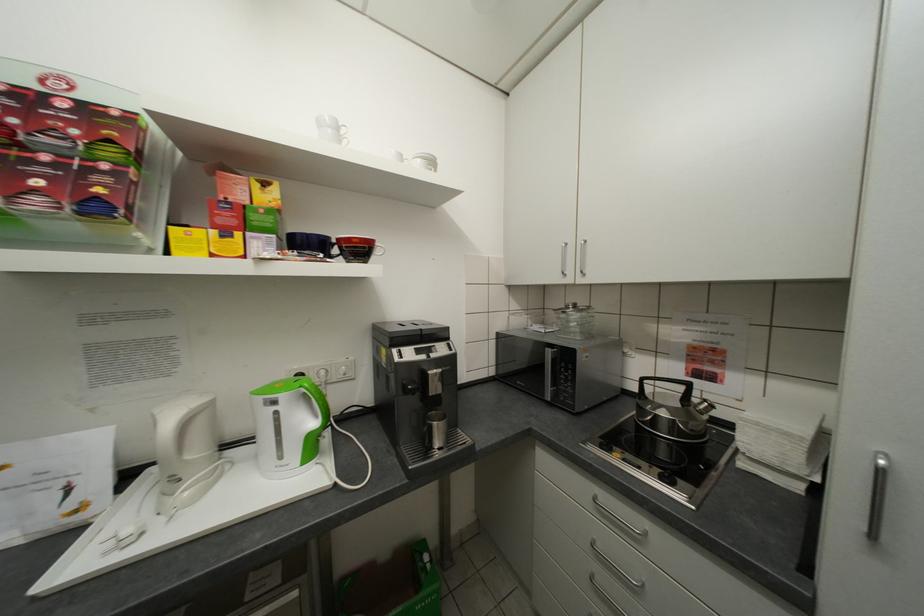
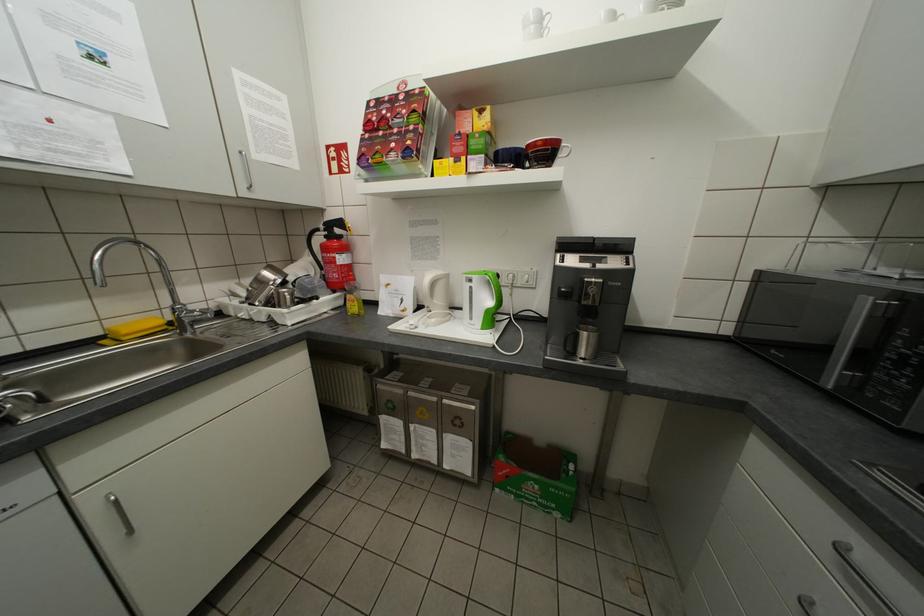
Where in the second image is the point corresponding to (x=310, y=387) from the first image?

(494, 274)